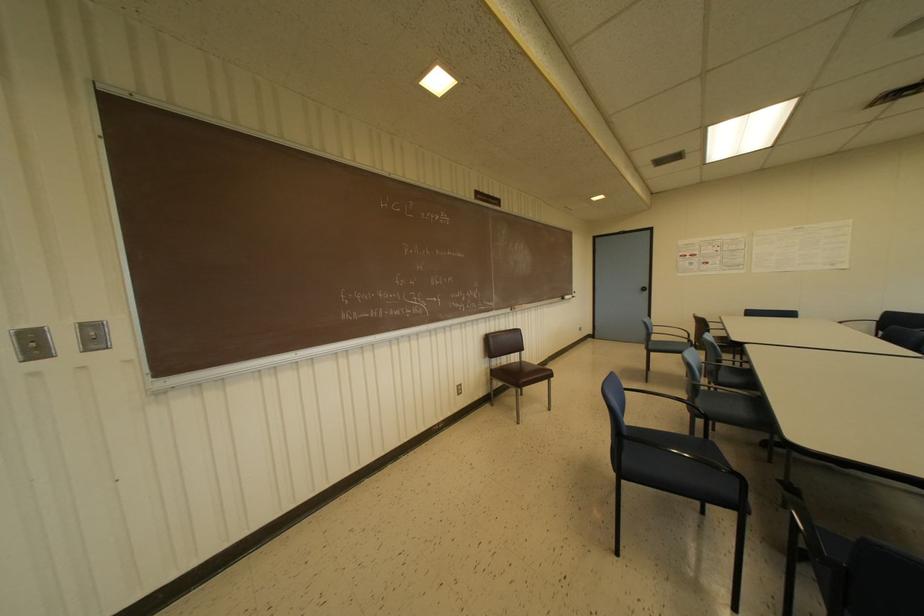
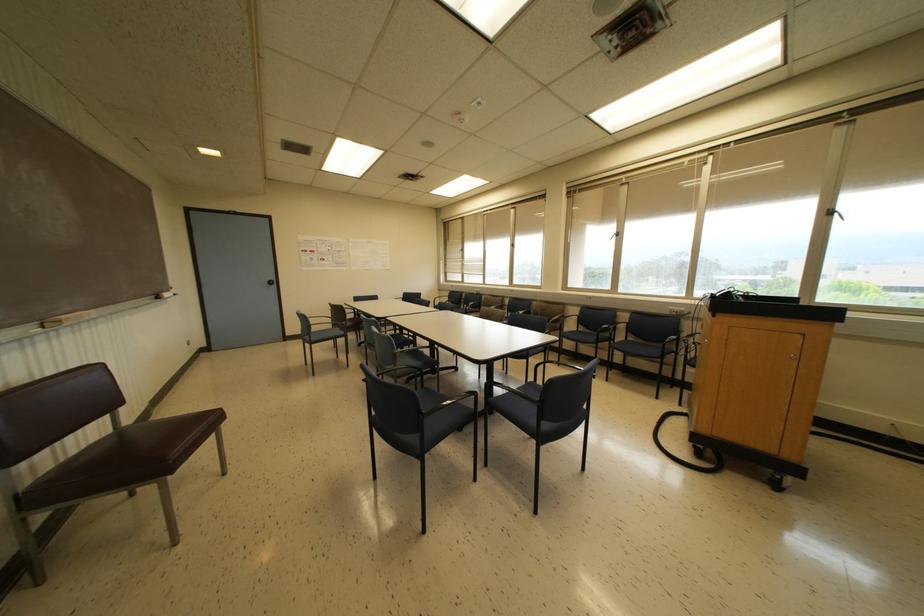
The point at (562, 298) is marked in the first image. Where is the corresponding point in the second image?

(157, 297)